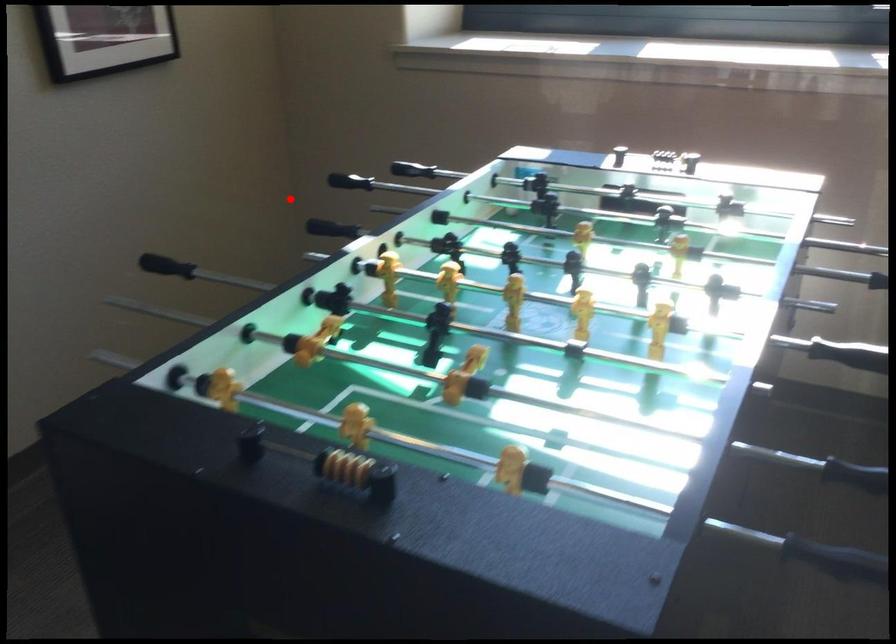
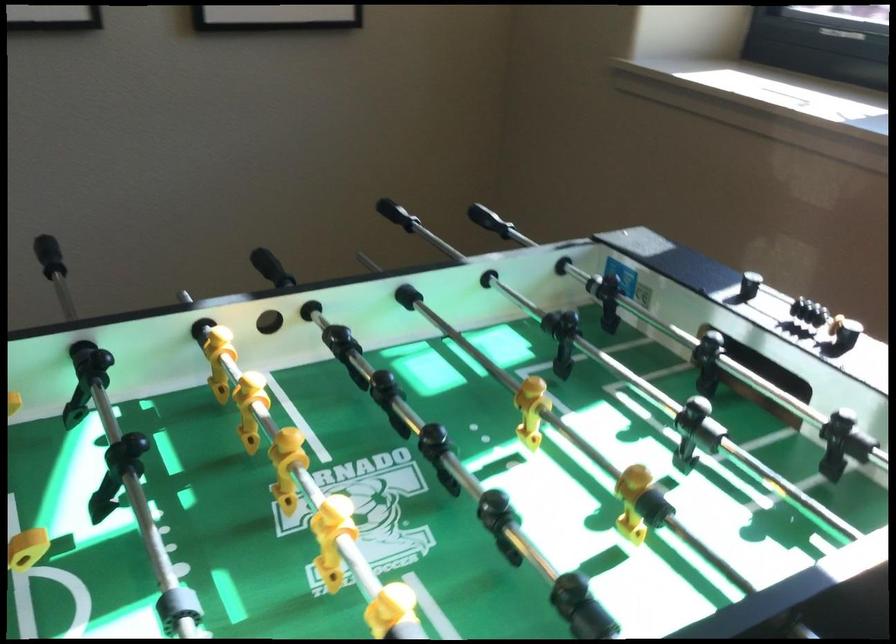
Find the pixel in the second image that matches the highlighted location in the first image.

(488, 220)